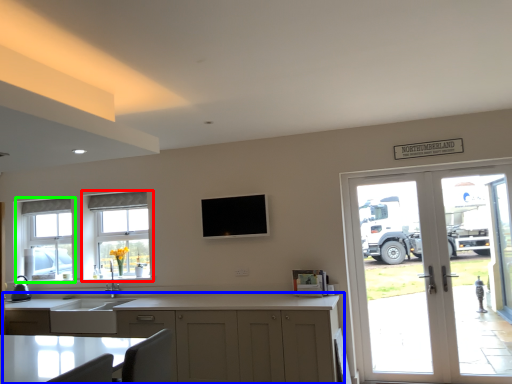
Question: Which is nearer to the window (highlighted by a red box)? cabinetry (highlighted by a blue box) or window (highlighted by a green box).

Choices:
 (A) cabinetry
 (B) window

Answer: (B)